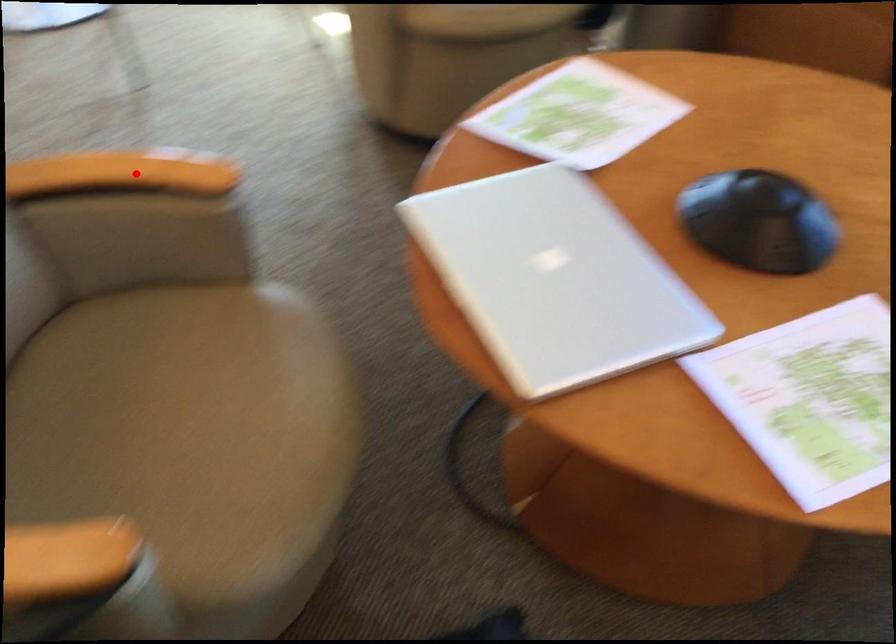
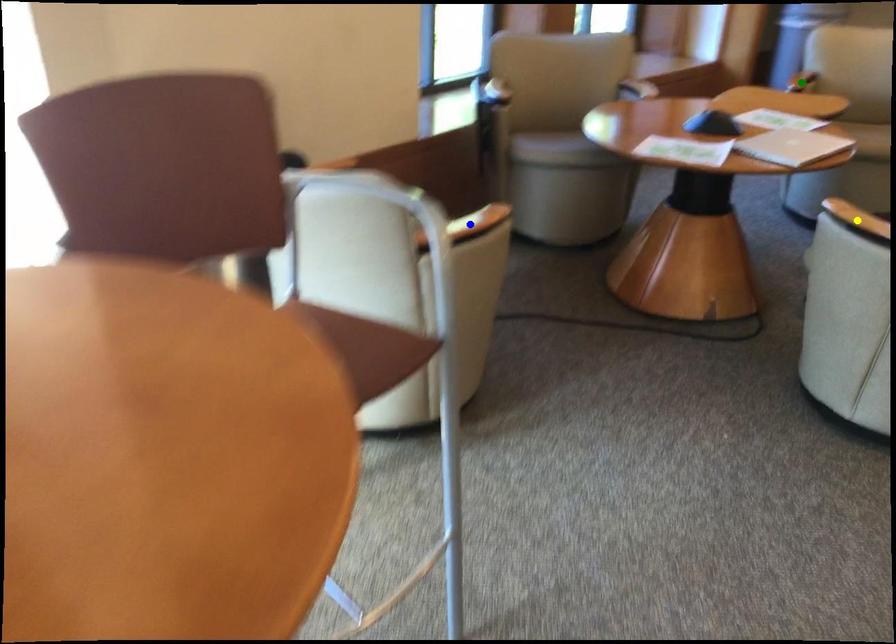
Question: I am providing you with two images of the same scene from different viewpoints. A red point is marked on the first image. You are given multiple points on the second image. Which spot in image 2 lines up with the point in image 1?

Choices:
 (A) green point
 (B) yellow point
 (C) blue point

Answer: (B)